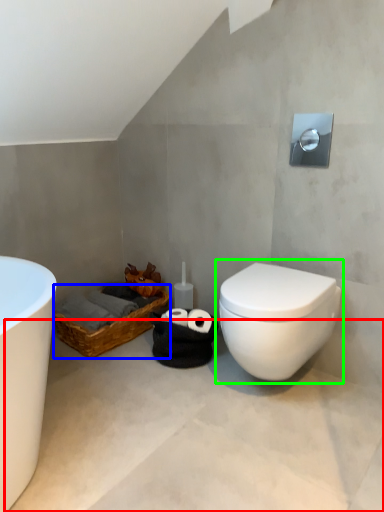
Question: Considering the real-world distances, which object is closest to concrete (highlighted by a red box)? basket (highlighted by a blue box) or toilet (highlighted by a green box).

Choices:
 (A) basket
 (B) toilet

Answer: (B)